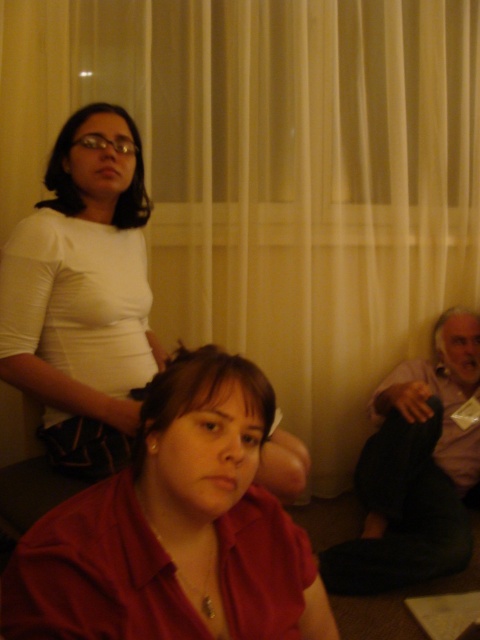
Is matte white shirt at upper left bigger than light pink fabric shirt at lower right?

No.

Does point (2, 298) come farther from viewer compared to point (381, 436)?

No, it is in front of (381, 436).

Describe the element at coordinates (83, 284) in the screenshot. I see `matte white shirt at upper left` at that location.

Find the location of a particular element. This screenshot has width=480, height=640. matte white shirt at upper left is located at coordinates (83, 284).

Who is lower down, matte red shirt at center or matte white shirt at upper left?

matte red shirt at center is lower down.

Does matte red shirt at center appear under matte white shirt at upper left?

Indeed, matte red shirt at center is positioned under matte white shirt at upper left.

Who is more forward, (178,440) or (56,452)?

Point (178,440) is in front.

Where is `matte red shirt at center`? This screenshot has height=640, width=480. matte red shirt at center is located at coordinates (175, 529).

Is matte red shirt at center positioned at the back of light pink fabric shirt at lower right?

No, it is in front of light pink fabric shirt at lower right.

Which is below, matte red shirt at center or light pink fabric shirt at lower right?

light pink fabric shirt at lower right is lower down.

Where is `matte red shirt at center`? matte red shirt at center is located at coordinates (175, 529).